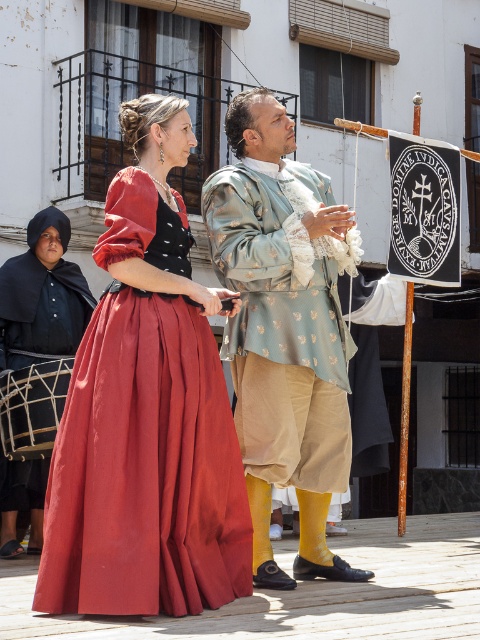
You are a costume designer observing the scene. You need to determine which dress has a larger width between the satin dress at center and the satin black dress at left. According to the scene, which one is wider?

The satin dress at center is wider than the satin black dress at left.

You are a photographer on the wooden stage and want to capture the silk dress at center and the silky blue fabric at center in your photo. Which object should you focus on first if you want to ensure both are in sharp focus?

The silk dress at center is below the silky blue fabric at center. To ensure both are in sharp focus, you should focus on the silky blue fabric at center first since it is closer to the camera, and the silk dress at center will naturally fall within the depth of field if focused on the nearer object.

You are a costume designer observing a historical performance. You notice two items at the center of the stage, the silk dress at center and the silky blue fabric at center. Which one has a larger size?

The silk dress at center is bigger than the silky blue fabric at center.